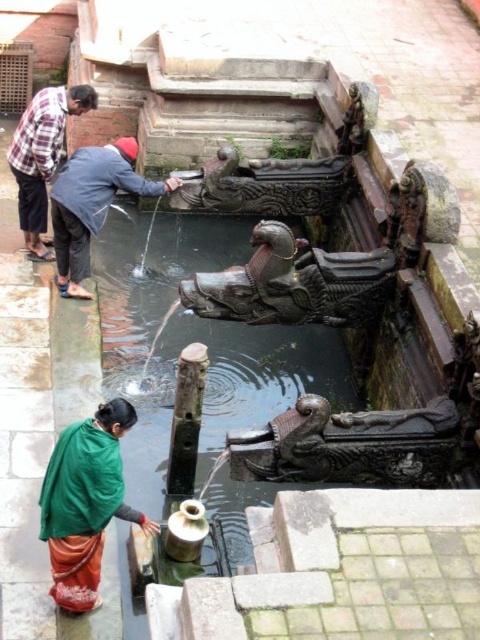
You are a visitor at the temple and want to take a photo of the black polished stone dragon at center and the plaid shirt at upper left. Which object should you zoom in more on to capture both in the frame?

You should zoom in more on the plaid shirt at upper left because the black polished stone dragon at center occupies less space than the plaid shirt at upper left, meaning it is smaller and can be captured while focusing more on the larger object.

You are a visitor at the temple fountain and want to fill your bottle with water. You see the dark brown stone dragon at center and the green fabric at lower left. Which object is higher up in the image?

The dark brown stone dragon at center is located above the green fabric at lower left, so it is higher up in the image.

You are standing in front of the fountain and see a green fabric at lower left and a plaid shirt at upper left. Which object is closer to the right edge of the image?

The green fabric at lower left is positioned on the right side of plaid shirt at upper left, so the green fabric at lower left is closer to the right edge of the image.